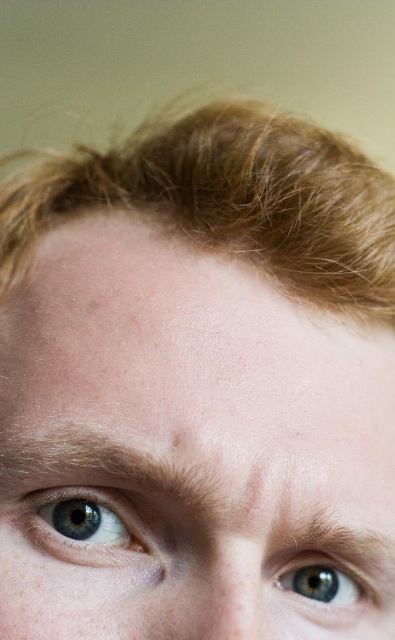
Looking at the portrait, where is the pale skin at center in relation to the light brown textured hair at upper center?

The pale skin at center is to the right of the light brown textured hair at upper center.

From the picture: The pale skin at center has two distinct features. How far apart are these two features?

The two features on the pale skin at center are 10.64 inches apart.